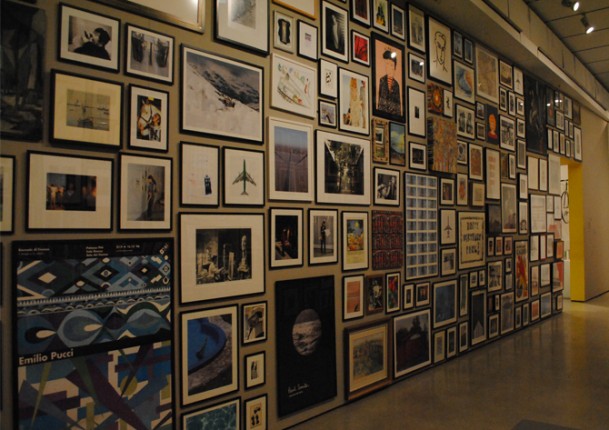
What are the coordinates of `wall` in the screenshot? It's located at (597, 194), (268, 274).